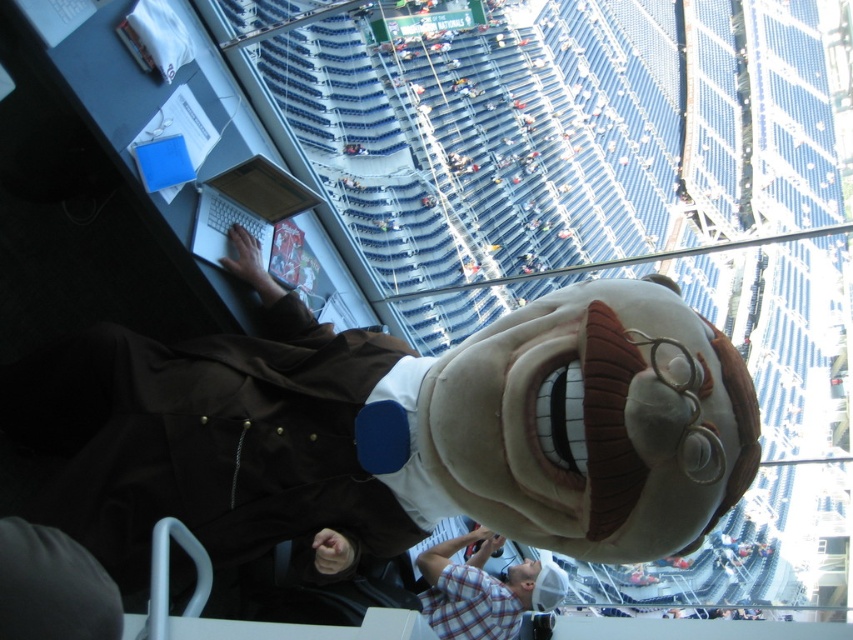
Is brown plush mascot at center wider than plaid shirt at lower center?

Yes, brown plush mascot at center is wider than plaid shirt at lower center.

Can you confirm if brown plush mascot at center is taller than plaid shirt at lower center?

Yes, brown plush mascot at center is taller than plaid shirt at lower center.

Where is `brown plush mascot at center`? This screenshot has width=853, height=640. brown plush mascot at center is located at coordinates (409, 428).